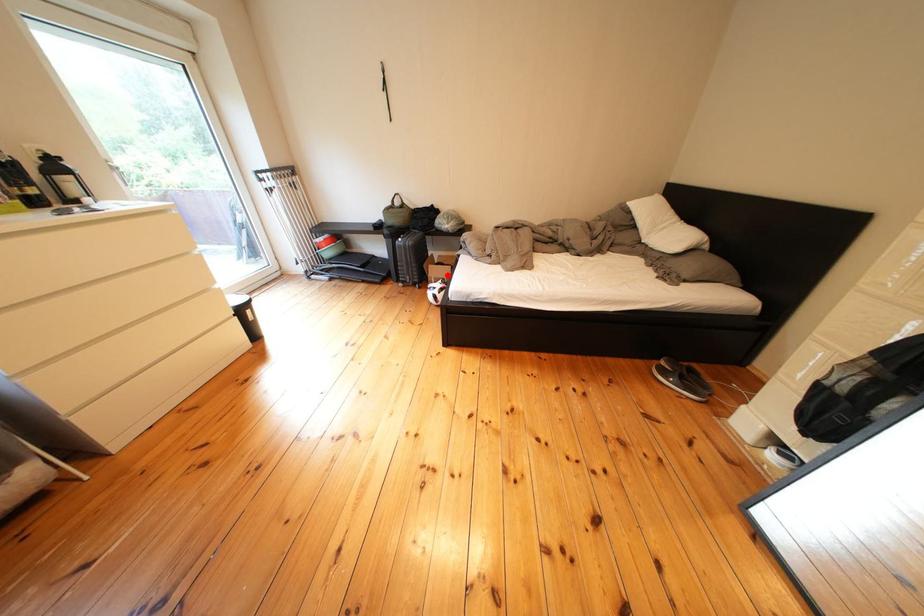
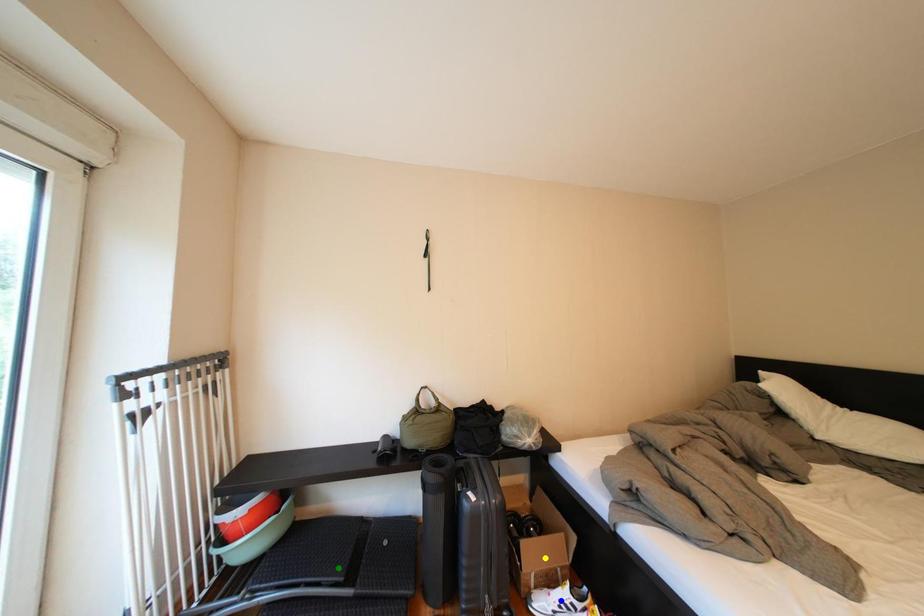
Question: I am providing you with two images of the same scene from different viewpoints. A red point is marked on the first image. You are given multiple points on the second image. Which mark in image 2 goes with the point in image 1?

Choices:
 (A) green point
 (B) blue point
 (C) yellow point

Answer: (C)